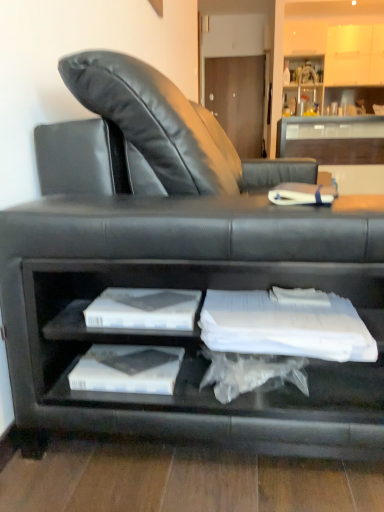
Question: From the image's perspective, is clear glass table at upper center located above white paper at center?

Choices:
 (A) yes
 (B) no

Answer: (A)

Question: Is clear glass table at upper center in contact with white paper at center?

Choices:
 (A) yes
 (B) no

Answer: (B)

Question: Can you confirm if clear glass table at upper center is wider than white paper at center?

Choices:
 (A) no
 (B) yes

Answer: (B)

Question: Does clear glass table at upper center lie in front of white paper at center?

Choices:
 (A) no
 (B) yes

Answer: (A)

Question: Is clear glass table at upper center to the right of white paper at center from the viewer's perspective?

Choices:
 (A) yes
 (B) no

Answer: (A)

Question: From a real-world perspective, is clear glass table at upper center located beneath white paper at center?

Choices:
 (A) no
 (B) yes

Answer: (B)

Question: Is white paper at lower center outside matte white cabinet at upper right?

Choices:
 (A) yes
 (B) no

Answer: (A)

Question: Is white paper at lower center facing towards matte white cabinet at upper right?

Choices:
 (A) yes
 (B) no

Answer: (B)

Question: Is white paper at lower center shorter than matte white cabinet at upper right?

Choices:
 (A) yes
 (B) no

Answer: (A)

Question: Is white paper at lower center to the left of matte white cabinet at upper right from the viewer's perspective?

Choices:
 (A) no
 (B) yes

Answer: (B)

Question: Are white paper at lower center and matte white cabinet at upper right making contact?

Choices:
 (A) yes
 (B) no

Answer: (B)

Question: Are white paper at lower center and matte white cabinet at upper right located far from each other?

Choices:
 (A) yes
 (B) no

Answer: (A)

Question: Would you consider white paper at center to be distant from clear glass table at upper center?

Choices:
 (A) yes
 (B) no

Answer: (A)